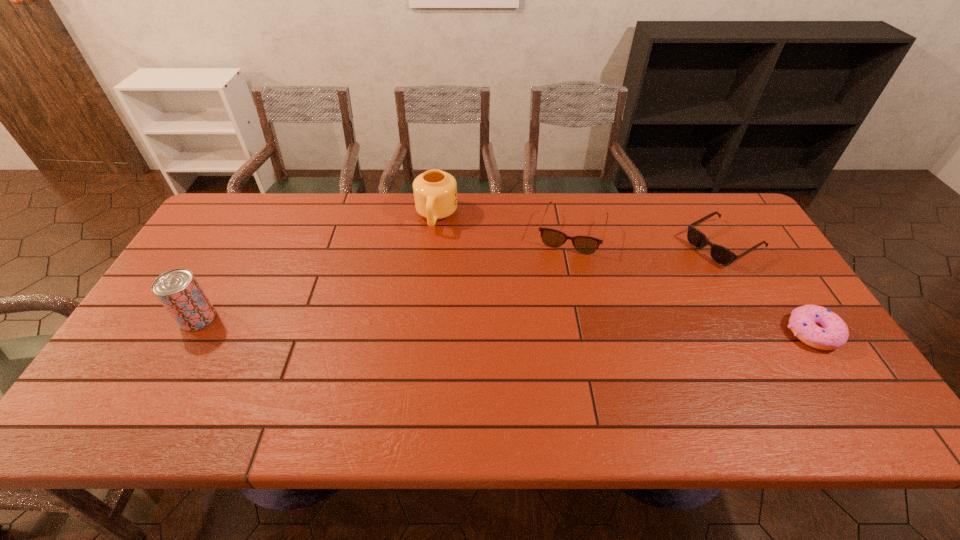
Where is `free location located at the front lenses of the sunglasses`? This screenshot has height=540, width=960. free location located at the front lenses of the sunglasses is located at coordinates (603, 310).

Where is `vacant region located 0.220m at the front lenses of the sunglasses`? This screenshot has width=960, height=540. vacant region located 0.220m at the front lenses of the sunglasses is located at coordinates (646, 287).

The image size is (960, 540). What are the coordinates of `vacant space situated at the front lenses of the sunglasses` in the screenshot? It's located at (609, 308).

At what (x,y) coordinates should I click in order to perform the action: click on vacant area situated on the handle side of the fourth object from right to left. Please return your answer as a coordinate pair (x, y). Looking at the image, I should click on (410, 335).

I want to click on vacant area situated on the handle side of the fourth object from right to left, so click(426, 261).

You are a GUI agent. You are given a task and a screenshot of the screen. Output one action in this format:
    pyautogui.click(x=<x>, y=<y>)
    Task: Click on the free spot located 0.360m on the handle side of the fourth object from right to left
    This screenshot has height=540, width=960.
    Given the screenshot: What is the action you would take?
    pyautogui.click(x=412, y=326)

You are a GUI agent. You are given a task and a screenshot of the screen. Output one action in this format:
    pyautogui.click(x=<x>, y=<y>)
    Task: Click on the spectacles that is at the far edge
    The height and width of the screenshot is (540, 960).
    Given the screenshot: What is the action you would take?
    pyautogui.click(x=583, y=244)

What are the coordinates of `sunglasses at the far edge` in the screenshot? It's located at (721, 255).

At what (x,y) coordinates should I click in order to perform the action: click on mug that is at the far edge. Please return your answer as a coordinate pair (x, y). The width and height of the screenshot is (960, 540). Looking at the image, I should click on (435, 192).

You are a GUI agent. You are given a task and a screenshot of the screen. Output one action in this format:
    pyautogui.click(x=<x>, y=<y>)
    Task: Click on the object that is at the left edge
    This screenshot has width=960, height=540.
    Given the screenshot: What is the action you would take?
    pyautogui.click(x=179, y=292)